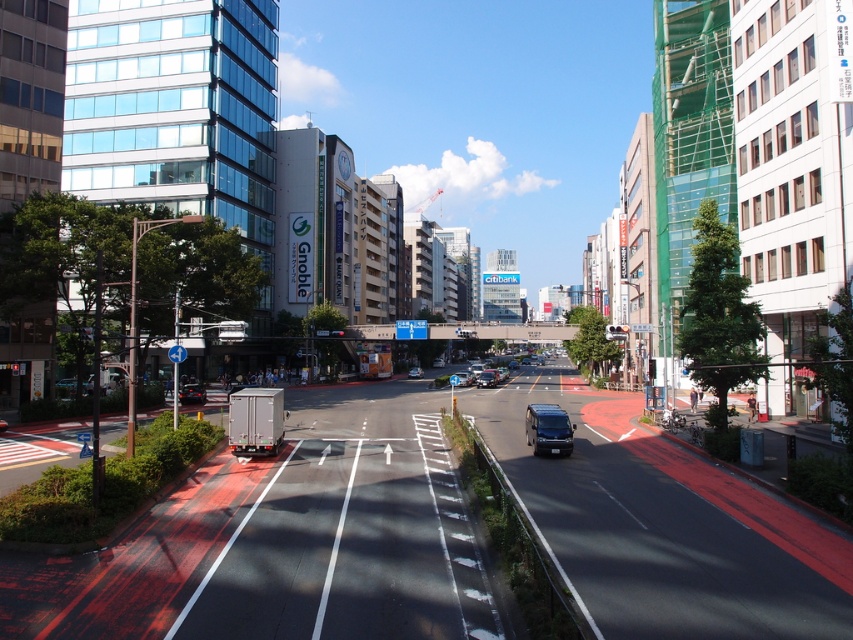
Does matte black van at center appear on the right side of silver metallic sedan at center?

Correct, you'll find matte black van at center to the right of silver metallic sedan at center.

Which of these two, matte black van at center or silver metallic sedan at center, stands taller?

matte black van at center

The height and width of the screenshot is (640, 853). I want to click on matte black van at center, so click(486, 378).

From the picture: Does metallic silver van at center have a lesser height compared to silver metallic sedan at center?

In fact, metallic silver van at center may be taller than silver metallic sedan at center.

Between metallic silver van at center and silver metallic sedan at center, which one appears on the left side from the viewer's perspective?

Positioned to the left is silver metallic sedan at center.

Find the location of `metallic silver van at center`. metallic silver van at center is located at coordinates (548, 429).

Is point (202, 403) farther from camera compared to point (495, 384)?

No, it is in front of (495, 384).

In the scene shown: Between shiny black car at lower left and matte black van at center, which one appears on the right side from the viewer's perspective?

From the viewer's perspective, matte black van at center appears more on the right side.

Which is behind, point (180, 387) or point (492, 374)?

The point (492, 374) is more distant.

At what (x,y) coordinates should I click in order to perform the action: click on shiny black car at lower left. Please return your answer as a coordinate pair (x, y). The height and width of the screenshot is (640, 853). Looking at the image, I should click on (190, 394).